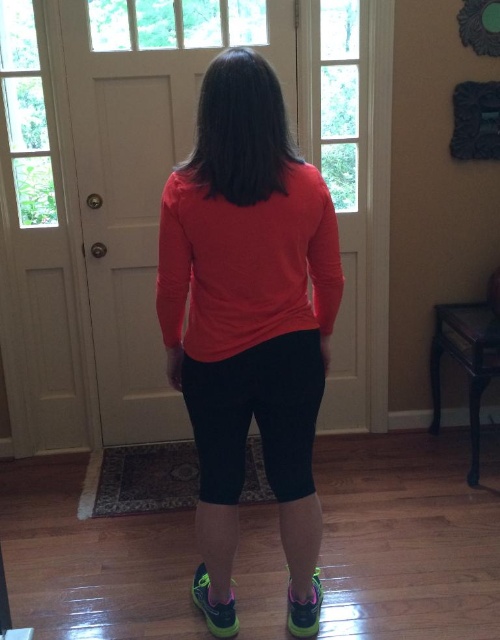
Question: Which point is closer to the camera?

Choices:
 (A) (316, 625)
 (B) (240, 291)
 (C) (206, 614)

Answer: (B)

Question: Can you confirm if matte red shirt at center is smaller than neon green mesh shoe at lower center?

Choices:
 (A) yes
 (B) no

Answer: (B)

Question: Can you confirm if neon green mesh sneaker at lower center is positioned to the right of neon green mesh shoe at lower center?

Choices:
 (A) no
 (B) yes

Answer: (A)

Question: Which object is farther from the camera taking this photo?

Choices:
 (A) black matte leggings at center
 (B) neon green mesh shoe at lower center

Answer: (B)

Question: Does neon green mesh sneaker at lower center appear over neon green mesh shoe at lower center?

Choices:
 (A) yes
 (B) no

Answer: (B)

Question: Estimate the real-world distances between objects in this image. Which object is farther from the matte red shirt at center?

Choices:
 (A) black matte leggings at center
 (B) neon green mesh shoe at lower center

Answer: (B)